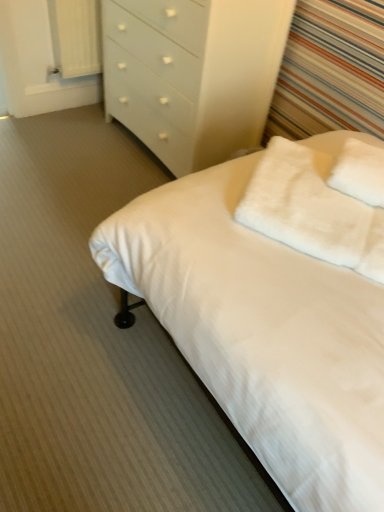
Question: Is white fabric curtain at upper left not within white glossy chest of drawers at upper center?

Choices:
 (A) no
 (B) yes

Answer: (B)

Question: Is white fabric curtain at upper left closer to the viewer compared to white glossy chest of drawers at upper center?

Choices:
 (A) no
 (B) yes

Answer: (A)

Question: Can you confirm if white fabric curtain at upper left is positioned to the left of white glossy chest of drawers at upper center?

Choices:
 (A) no
 (B) yes

Answer: (B)

Question: Is white fabric curtain at upper left behind white glossy chest of drawers at upper center?

Choices:
 (A) no
 (B) yes

Answer: (B)

Question: Is white fabric curtain at upper left in contact with white glossy chest of drawers at upper center?

Choices:
 (A) no
 (B) yes

Answer: (A)

Question: Visually, is white soft bed at center positioned to the left or to the right of white fabric curtain at upper left?

Choices:
 (A) right
 (B) left

Answer: (A)

Question: Is white soft bed at center taller or shorter than white fabric curtain at upper left?

Choices:
 (A) short
 (B) tall

Answer: (A)

Question: Is white soft bed at center wider or thinner than white fabric curtain at upper left?

Choices:
 (A) wide
 (B) thin

Answer: (A)

Question: From the image's perspective, is white soft bed at center located above or below white fabric curtain at upper left?

Choices:
 (A) below
 (B) above

Answer: (A)

Question: Is white fluffy pillow at upper right, which appears as the second pillow when viewed from the right, wider or thinner than white glossy chest of drawers at upper center?

Choices:
 (A) thin
 (B) wide

Answer: (A)

Question: Is point (324, 208) closer or farther from the camera than point (137, 45)?

Choices:
 (A) closer
 (B) farther

Answer: (A)

Question: Would you say white fluffy pillow at upper right, marked as the 1th pillow in a left-to-right arrangement, is inside or outside white glossy chest of drawers at upper center?

Choices:
 (A) outside
 (B) inside

Answer: (A)

Question: From a real-world perspective, is white fluffy pillow at upper right, which appears as the second pillow when viewed from the right, positioned above or below white glossy chest of drawers at upper center?

Choices:
 (A) below
 (B) above

Answer: (B)

Question: Would you say white fabric curtain at upper left is inside or outside white fluffy pillow at upper right, marked as the 1th pillow in a left-to-right arrangement?

Choices:
 (A) inside
 (B) outside

Answer: (B)

Question: Considering their positions, is white fabric curtain at upper left located in front of or behind white fluffy pillow at upper right, marked as the 1th pillow in a left-to-right arrangement?

Choices:
 (A) behind
 (B) front

Answer: (A)